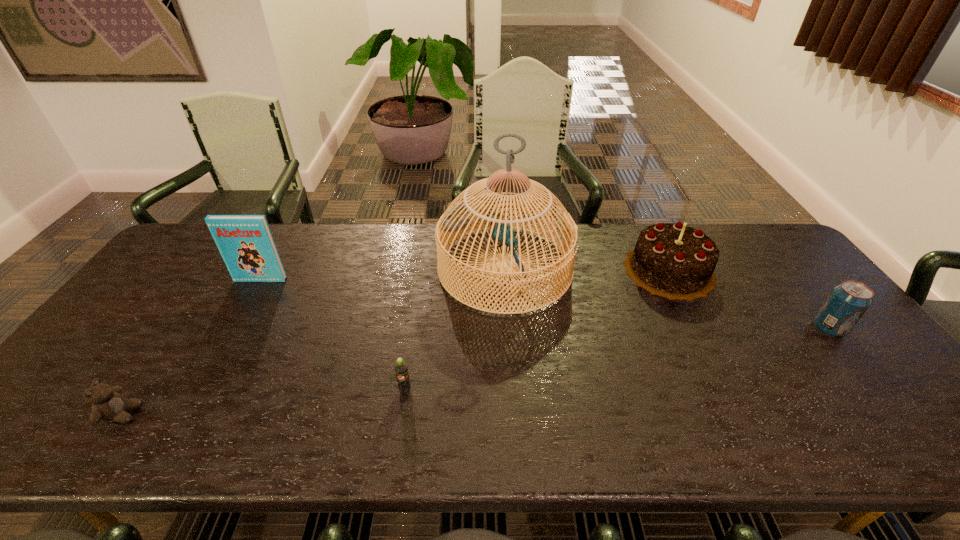
The width and height of the screenshot is (960, 540). In order to click on free space between the birthday cake and the teddy bear in this screenshot , I will do `click(396, 342)`.

Identify which object is located as the fourth nearest to the birthday cake. Please provide its 2D coordinates. Your answer should be formatted as a tuple, i.e. [(x, y)], where the tuple contains the x and y coordinates of a point satisfying the conditions above.

[(245, 242)]

Locate which object ranks fifth in proximity to the birthday cake. Please provide its 2D coordinates. Your answer should be formatted as a tuple, i.e. [(x, y)], where the tuple contains the x and y coordinates of a point satisfying the conditions above.

[(108, 404)]

Image resolution: width=960 pixels, height=540 pixels. I want to click on free spot that satisfies the following two spatial constraints: 1. on the front label of the shorter soda; 2. on the face of the nearest object, so click(401, 414).

I want to click on free space that satisfies the following two spatial constraints: 1. on the front cover of the fifth shortest object; 2. on the face of the teddy bear, so click(185, 414).